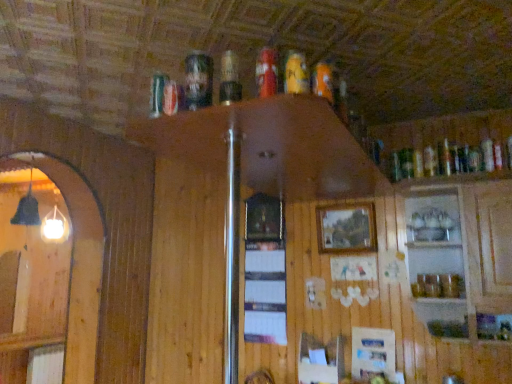
Question: From the image's perspective, is orange matte can at upper center, the 1th beer from the right, beneath clear glass cabinet at upper right?

Choices:
 (A) no
 (B) yes

Answer: (A)

Question: Considering the relative sizes of orange matte can at upper center, the 1th beer from the right, and clear glass cabinet at upper right in the image provided, is orange matte can at upper center, the 1th beer from the right, smaller than clear glass cabinet at upper right?

Choices:
 (A) yes
 (B) no

Answer: (A)

Question: Does orange matte can at upper center, which appears as the fourth beer when viewed from the left, have a greater height compared to clear glass cabinet at upper right?

Choices:
 (A) no
 (B) yes

Answer: (A)

Question: Is orange matte can at upper center, the 1th beer from the right, thinner than clear glass cabinet at upper right?

Choices:
 (A) no
 (B) yes

Answer: (B)

Question: Considering the relative sizes of orange matte can at upper center, the 1th beer from the right, and clear glass cabinet at upper right in the image provided, is orange matte can at upper center, the 1th beer from the right, shorter than clear glass cabinet at upper right?

Choices:
 (A) no
 (B) yes

Answer: (B)

Question: In the image, is orange matte can at upper center, the 1th beer from the right, positioned in front of or behind clear glass cabinet at upper right?

Choices:
 (A) front
 (B) behind

Answer: (A)

Question: Choose the correct answer: Is orange matte can at upper center, the 1th beer from the right, inside clear glass cabinet at upper right or outside it?

Choices:
 (A) inside
 (B) outside

Answer: (B)

Question: Would you say orange matte can at upper center, which appears as the fourth beer when viewed from the left, is to the left or to the right of clear glass cabinet at upper right in the picture?

Choices:
 (A) left
 (B) right

Answer: (A)

Question: From their relative heights in the image, would you say orange matte can at upper center, the 1th beer from the right, is taller or shorter than clear glass cabinet at upper right?

Choices:
 (A) short
 (B) tall

Answer: (A)

Question: In the image, is clear glass cabinet at upper right positioned in front of or behind wooden picture frame at center?

Choices:
 (A) behind
 (B) front

Answer: (B)

Question: Is clear glass cabinet at upper right inside or outside of wooden picture frame at center?

Choices:
 (A) inside
 (B) outside

Answer: (B)

Question: Is clear glass cabinet at upper right to the left or to the right of wooden picture frame at center in the image?

Choices:
 (A) right
 (B) left

Answer: (A)

Question: From a real-world perspective, is clear glass cabinet at upper right physically located above or below wooden picture frame at center?

Choices:
 (A) below
 (B) above

Answer: (A)

Question: From a real-world perspective, is orange matte can at upper center, which appears as the fourth beer when viewed from the left, above or below matte plastic beer at upper center, arranged as the 3th beer when viewed from the left?

Choices:
 (A) above
 (B) below

Answer: (A)

Question: Is orange matte can at upper center, the 1th beer from the right, wider or thinner than matte plastic beer at upper center, which is the second beer in right-to-left order?

Choices:
 (A) thin
 (B) wide

Answer: (B)